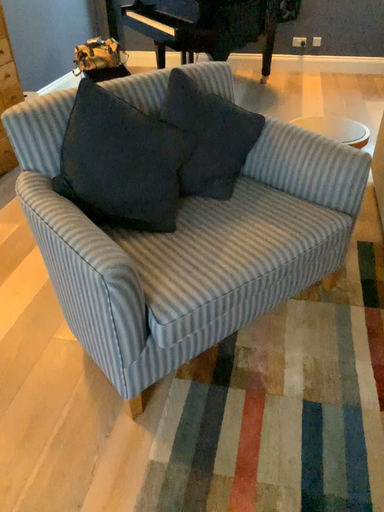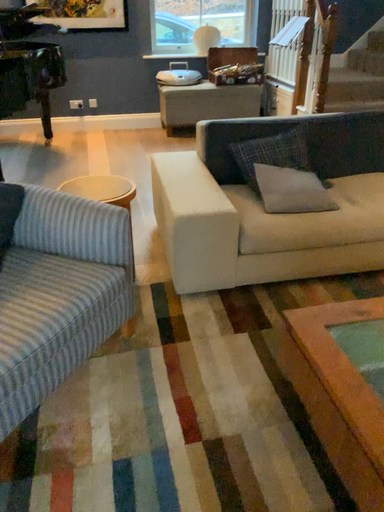
Question: Which way did the camera rotate in the video?

Choices:
 (A) rotated downward
 (B) rotated upward

Answer: (B)